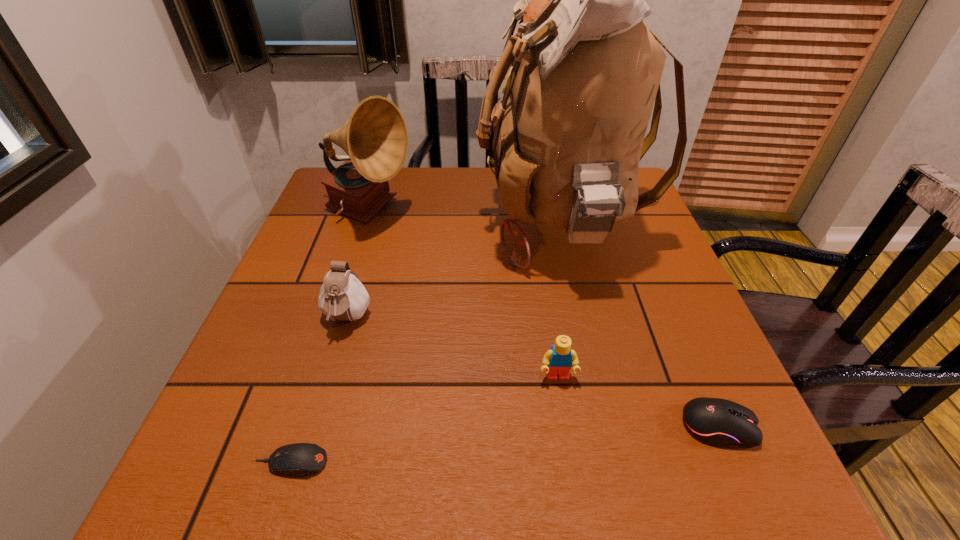
I want to click on the tallest object, so click(x=585, y=71).

At what (x,y) coordinates should I click in order to perform the action: click on phonograph record. Please return your answer as a coordinate pair (x, y). Looking at the image, I should click on (x=375, y=138).

This screenshot has width=960, height=540. In order to click on the third tallest object in this screenshot , I will do `click(342, 296)`.

In order to click on the fourth nearest object in this screenshot , I will do `click(342, 296)`.

The image size is (960, 540). Find the location of `the fourth farthest object`. the fourth farthest object is located at coordinates (559, 359).

The width and height of the screenshot is (960, 540). In order to click on Lego in this screenshot , I will do `click(559, 359)`.

This screenshot has height=540, width=960. Identify the location of the second shortest object. (719, 422).

This screenshot has width=960, height=540. Identify the location of the taller computer mouse. (719, 422).

I want to click on the shortest object, so click(x=300, y=459).

This screenshot has height=540, width=960. Identify the location of the shorter computer mouse. (300, 459).